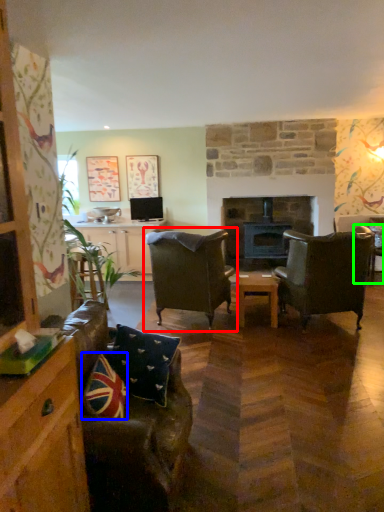
Question: Which object is the closest to the chair (highlighted by a red box)? Choose among these: pillow (highlighted by a blue box) or chair (highlighted by a green box).

Choices:
 (A) pillow
 (B) chair

Answer: (A)